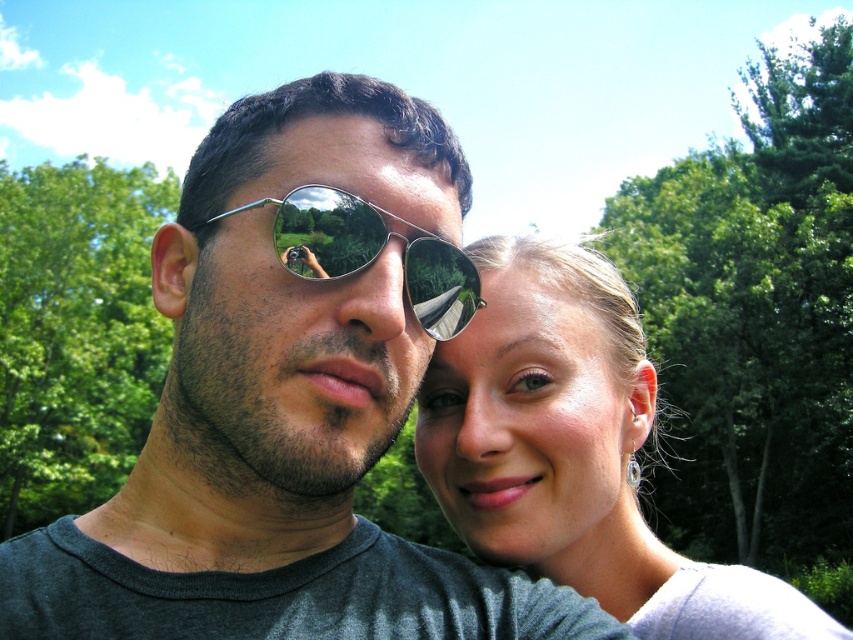
Does point (502, 422) come farther from viewer compared to point (163, 182)?

That is False.

Who is positioned more to the right, smooth skin face at right or green leafy tree at left?

Positioned to the right is smooth skin face at right.

The width and height of the screenshot is (853, 640). I want to click on smooth skin face at right, so click(x=573, y=451).

Can you confirm if matte black sunglasses at center is taller than green leafy tree at upper right?

Incorrect, matte black sunglasses at center's height is not larger of green leafy tree at upper right's.

Is point (229, 156) positioned after point (701, 276)?

No, (229, 156) is in front of (701, 276).

Between point (363, 225) and point (802, 280), which one is positioned in front?

Positioned in front is point (363, 225).

I want to click on matte black sunglasses at center, so click(x=289, y=397).

Can you confirm if matte black sunglasses at center is positioned above smooth skin face at right?

Correct, matte black sunglasses at center is located above smooth skin face at right.

Is matte black sunglasses at center positioned in front of smooth skin face at right?

Yes, matte black sunglasses at center is closer to the viewer.

Is point (334, 429) positioned after point (538, 266)?

No, (334, 429) is closer to viewer.

Where is `matte black sunglasses at center`? matte black sunglasses at center is located at coordinates (289, 397).